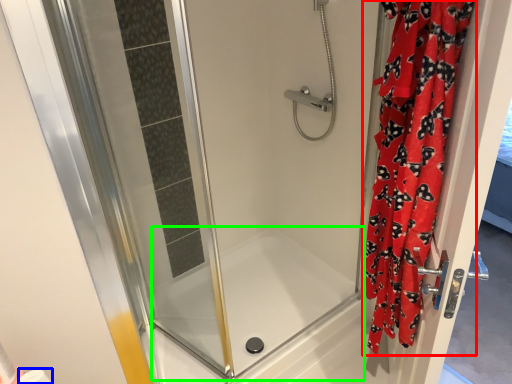
Question: Which object is positioned closest to curtain (highlighted by a red box)? Select from toilet paper (highlighted by a blue box) and bath (highlighted by a green box).

Choices:
 (A) toilet paper
 (B) bath

Answer: (B)